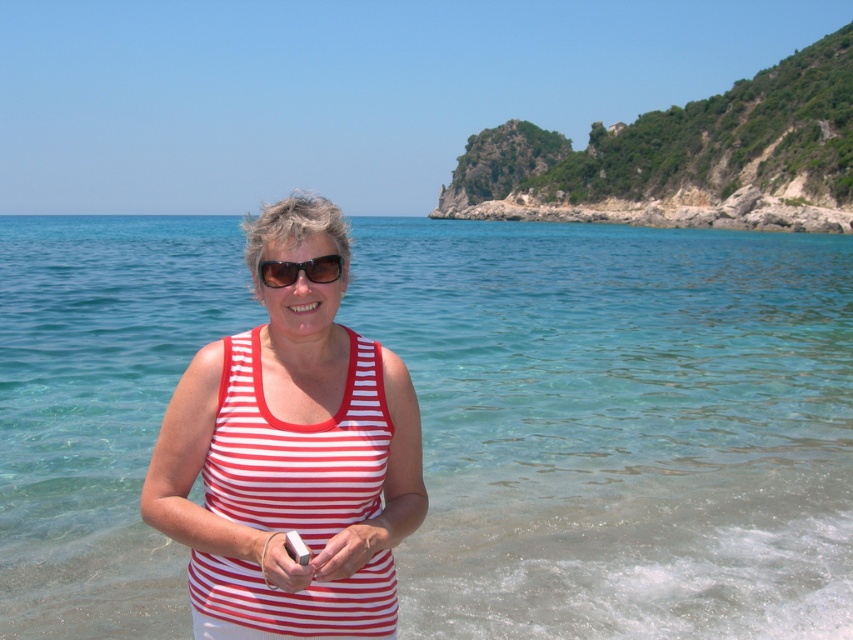
Is white striped tank top at center wider than black plastic sunglasses at center?

Correct, the width of white striped tank top at center exceeds that of black plastic sunglasses at center.

Does point (231, 342) come in front of point (297, 264)?

No, (231, 342) is further to viewer.

Looking at this image, measure the distance between white striped tank top at center and camera.

9.53 meters

Where is `white striped tank top at center`? white striped tank top at center is located at coordinates click(291, 452).

Which is above, clear water at center or white striped tank top at center?

Positioned higher is clear water at center.

Between clear water at center and white striped tank top at center, which one has less height?

Standing shorter between the two is white striped tank top at center.

Between point (509, 381) and point (360, 522), which one is positioned in front?

Positioned in front is point (360, 522).

Where is `clear water at center`? Image resolution: width=853 pixels, height=640 pixels. clear water at center is located at coordinates (619, 426).

Does clear water at center appear under black plastic sunglasses at center?

Incorrect, clear water at center is not positioned below black plastic sunglasses at center.

Is the position of clear water at center more distant than that of black plastic sunglasses at center?

That is True.

What do you see at coordinates (619, 426) in the screenshot?
I see `clear water at center` at bounding box center [619, 426].

I want to click on clear water at center, so click(x=619, y=426).